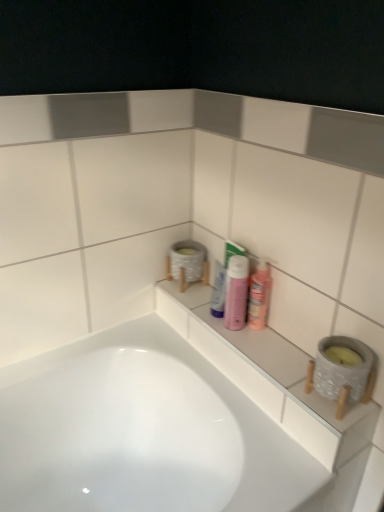
Find the location of a particular element. Image resolution: width=384 pixels, height=512 pixels. vacant space in front of pink glossy mouthwash at center, arranged as the first mouthwash when viewed from the right is located at coordinates (267, 351).